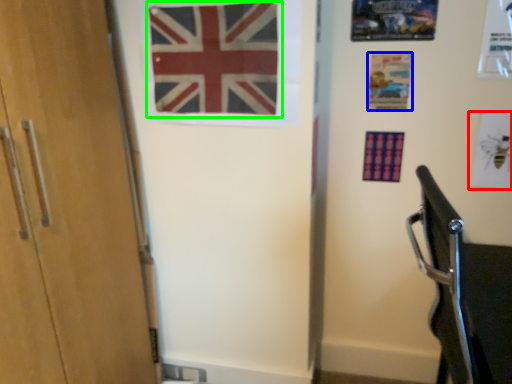
Question: Which is farther away from postcard (highlighted by a red box)? postcard (highlighted by a blue box) or flag (highlighted by a green box)?

Choices:
 (A) postcard
 (B) flag

Answer: (B)